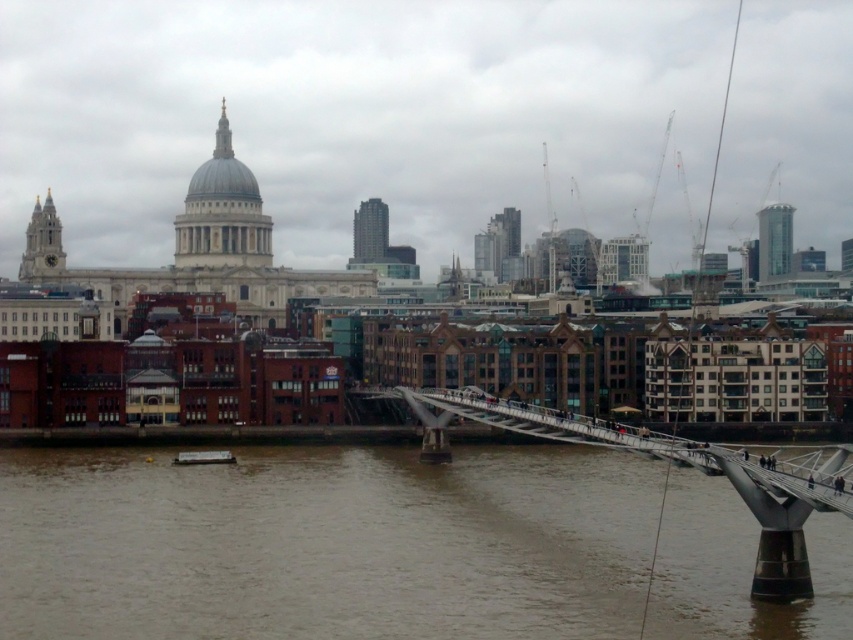
Image resolution: width=853 pixels, height=640 pixels. Find the location of `brown murky water at center`. brown murky water at center is located at coordinates (325, 544).

Between brown murky water at center and metallic silver bridge at center, which one appears on the right side from the viewer's perspective?

Positioned to the right is metallic silver bridge at center.

Is point (598, 476) more distant than point (827, 497)?

Yes.

Locate an element on the screen. brown murky water at center is located at coordinates (325, 544).